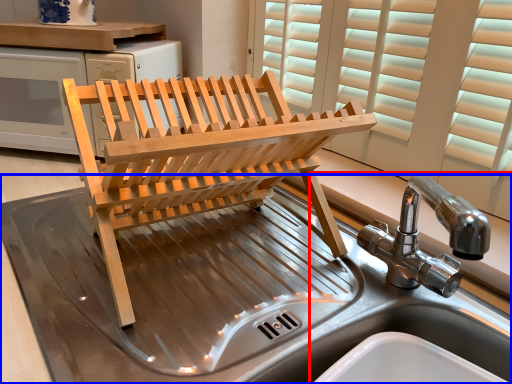
Question: Which object is further to the camera taking this photo, sink (highlighted by a red box) or sink (highlighted by a blue box)?

Choices:
 (A) sink
 (B) sink

Answer: (A)